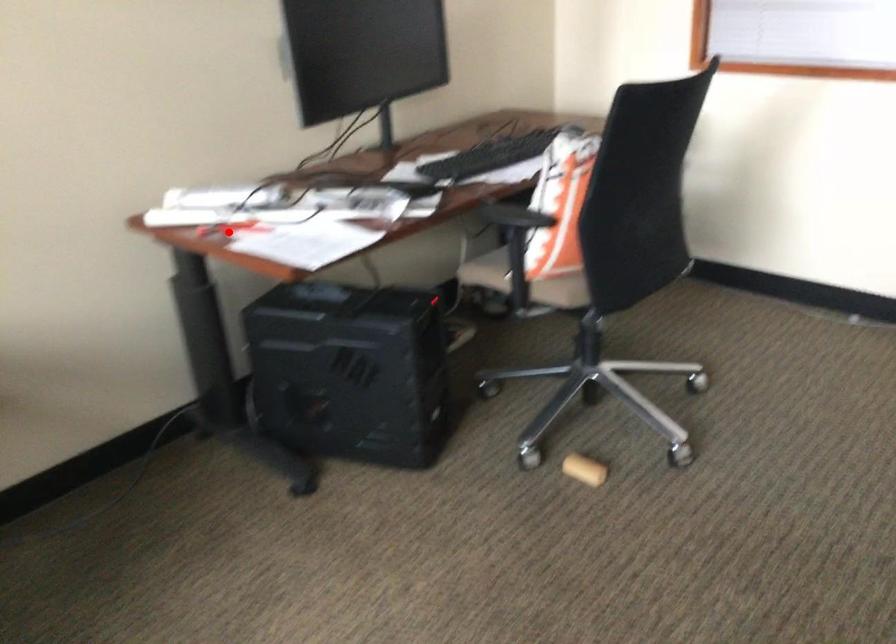
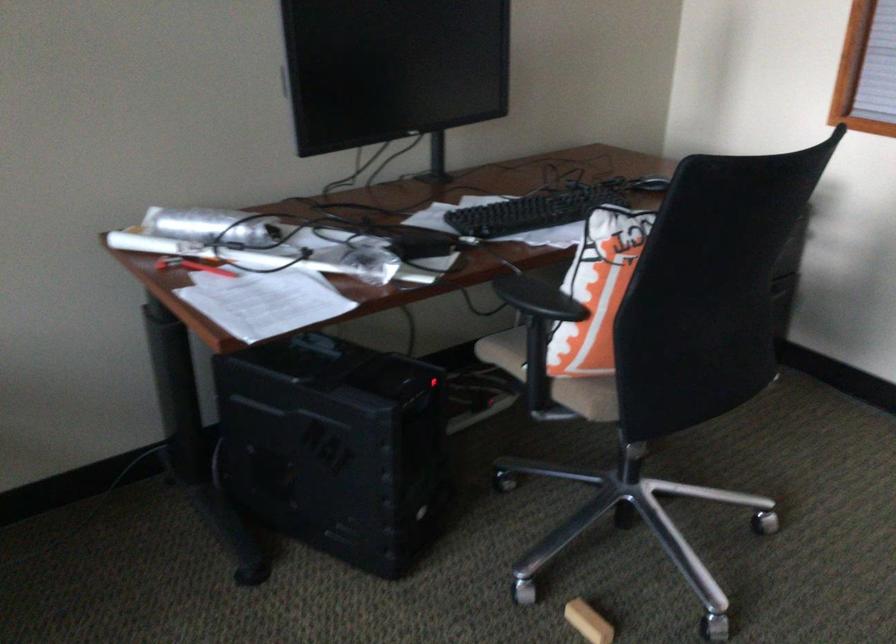
Question: I am providing you with two images of the same scene from different viewpoints. Image1 has a red point marked. In image2, the corresponding 3D location appears at what relative position? Reply with the corresponding letter.

Choices:
 (A) Closer
 (B) Farther

Answer: (A)